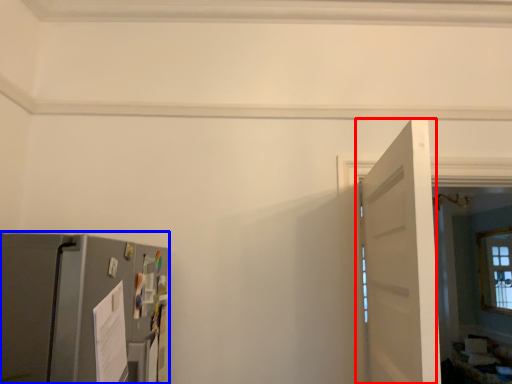
Question: Which of the following is the closest to the observer, door (highlighted by a red box) or appliance (highlighted by a blue box)?

Choices:
 (A) door
 (B) appliance

Answer: (B)